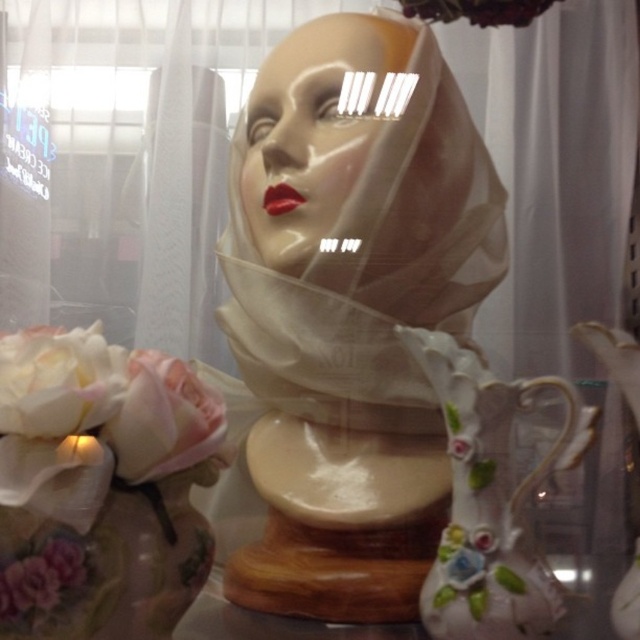
Based on the photo, between matte white bust at center and pink fabric flower at lower left, which one appears on the right side from the viewer's perspective?

matte white bust at center is more to the right.

Does matte white bust at center come in front of pink fabric flower at lower left?

No, matte white bust at center is further to the viewer.

This screenshot has width=640, height=640. I want to click on matte white bust at center, so tap(352, 307).

Locate an element on the screen. matte white bust at center is located at coordinates (352, 307).

Between porcelain vase at center and white porcelain flower at lower left, which one appears on the left side from the viewer's perspective?

white porcelain flower at lower left

The height and width of the screenshot is (640, 640). In order to click on porcelain vase at center in this screenshot , I will do `click(490, 499)`.

Find the location of a particular element. This screenshot has width=640, height=640. porcelain vase at center is located at coordinates (490, 499).

Looking at this image, who is shorter, porcelain vase at center or matte plastic face at center?

With less height is porcelain vase at center.

In order to click on porcelain vase at center in this screenshot , I will do `click(490, 499)`.